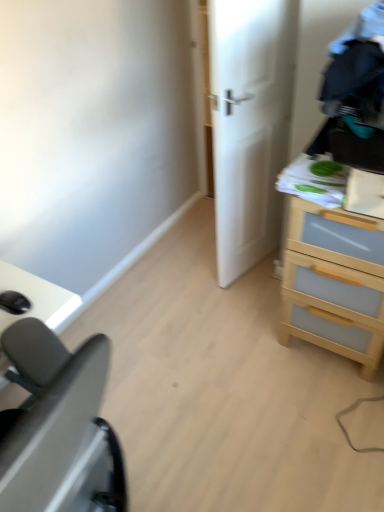
At what (x,y) coordinates should I click in order to perform the action: click on vacant space in front of white matte door at center. Please return your answer as a coordinate pair (x, y). This screenshot has width=384, height=512. Looking at the image, I should click on (251, 306).